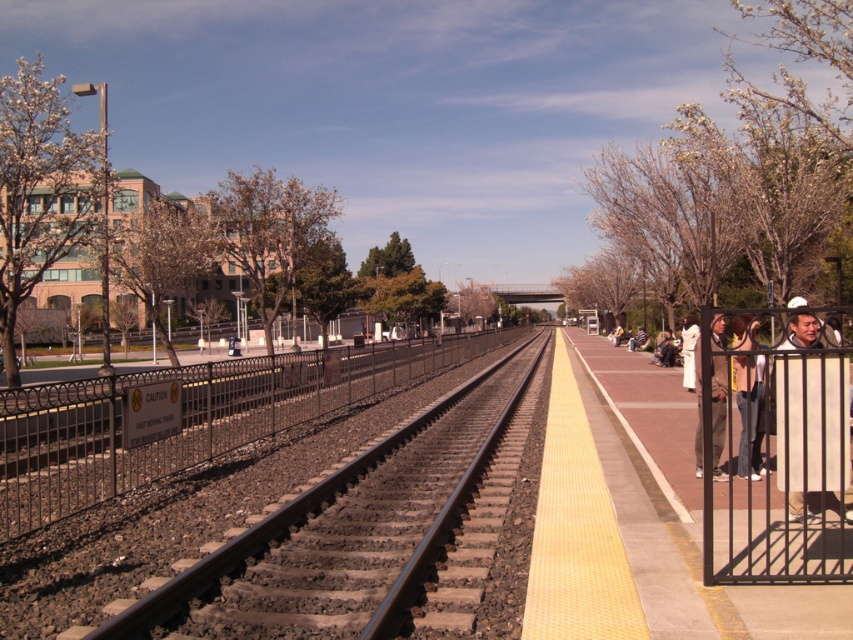
Question: Does smooth steel tracks at center have a greater width compared to denim pants at right?

Choices:
 (A) no
 (B) yes

Answer: (A)

Question: Which point is closer to the camera?

Choices:
 (A) white fabric jacket at right
 (B) black metal fence at right
 (C) khaki pants at right
 (D) smooth steel tracks at center

Answer: (D)

Question: Estimate the real-world distances between objects in this image. Which object is closer to the black metal fence at right?

Choices:
 (A) smooth steel tracks at center
 (B) white cloth at right
 (C) khaki pants at right
 (D) denim pants at right

Answer: (D)

Question: Can you confirm if denim pants at right is smaller than white fabric jacket at right?

Choices:
 (A) no
 (B) yes

Answer: (A)

Question: Does denim pants at right appear on the left side of khaki pants at right?

Choices:
 (A) no
 (B) yes

Answer: (A)

Question: Considering the real-world distances, which object is closest to the white fabric jacket at right?

Choices:
 (A) black metal fence at right
 (B) denim pants at right
 (C) smooth steel tracks at center

Answer: (B)